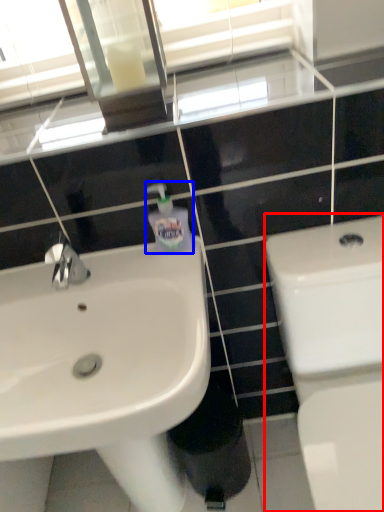
Question: Among these objects, which one is farthest to the camera, toilet (highlighted by a red box) or soap dispenser (highlighted by a blue box)?

Choices:
 (A) toilet
 (B) soap dispenser

Answer: (B)